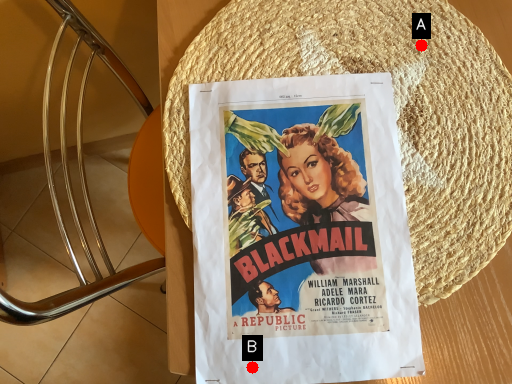
Question: Two points are circled on the image, labeled by A and B beside each circle. Among these points, which one is nearest to the camera?

Choices:
 (A) A is closer
 (B) B is closer

Answer: (B)